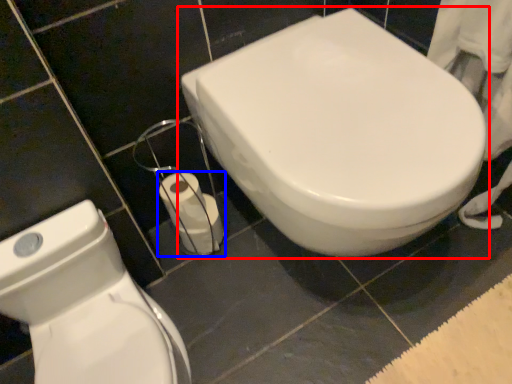
Question: Among these objects, which one is farthest to the camera, toilet (highlighted by a red box) or toilet paper (highlighted by a blue box)?

Choices:
 (A) toilet
 (B) toilet paper

Answer: (B)